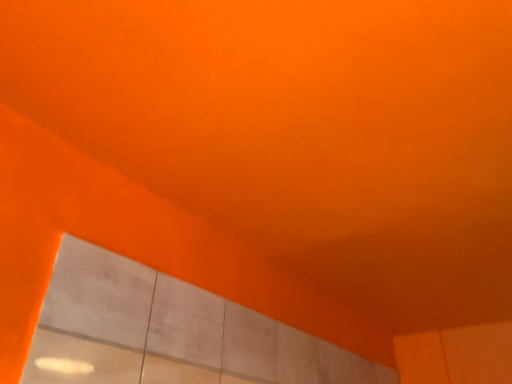
What is the approximate height of white marble window at lower center?

It is 15.77 inches.

The width and height of the screenshot is (512, 384). Describe the element at coordinates (170, 332) in the screenshot. I see `white marble window at lower center` at that location.

Find the location of a particular element. Image resolution: width=512 pixels, height=384 pixels. white marble window at lower center is located at coordinates [x=170, y=332].

Identify the location of white marble window at lower center. The height and width of the screenshot is (384, 512). (170, 332).